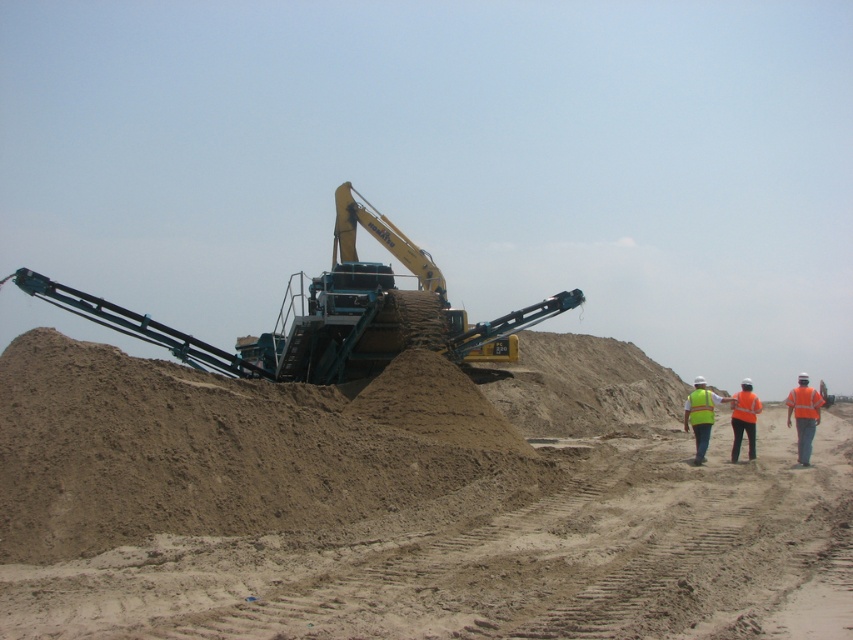
You are a safety inspector at the construction site. You notice two safety vests at the center of the image. The high visibility vest at center and the reflective orange vest at center. You need to ensure that safety equipment is within the 20 meter safety zone. Are both safety vests within the 20 meter safety zone?

The high visibility vest at center is 22.78 meters away from the reflective orange vest at center. Since the distance between them exceeds 20 meters, at least one of the vests is outside the 20 meter safety zone.

You are a safety inspector at the construction site. You notice two vests at the center of the image. Which vest is closer to you, the high visibility vest at center or the reflective orange vest at center?

The high visibility vest at center is closer to the viewer than the reflective orange vest at center.

You are a construction worker standing at the edge of the sand pile. You need to reach a specific point marked at coordinates point (392, 342). If your safety harness can only extend up to 40 meters, will you be able to safely reach that point?

The distance of point (392, 342) from viewer is 44.18 meters, so the safety harness cannot extend far enough to reach the point safely.